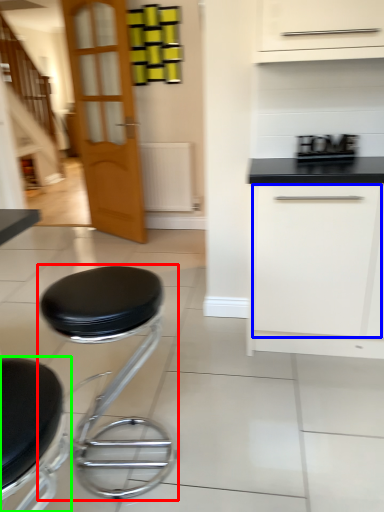
Question: Which object is positioned farthest from stool (highlighted by a red box)? Select from drawer (highlighted by a blue box) and stool (highlighted by a green box).

Choices:
 (A) drawer
 (B) stool

Answer: (A)